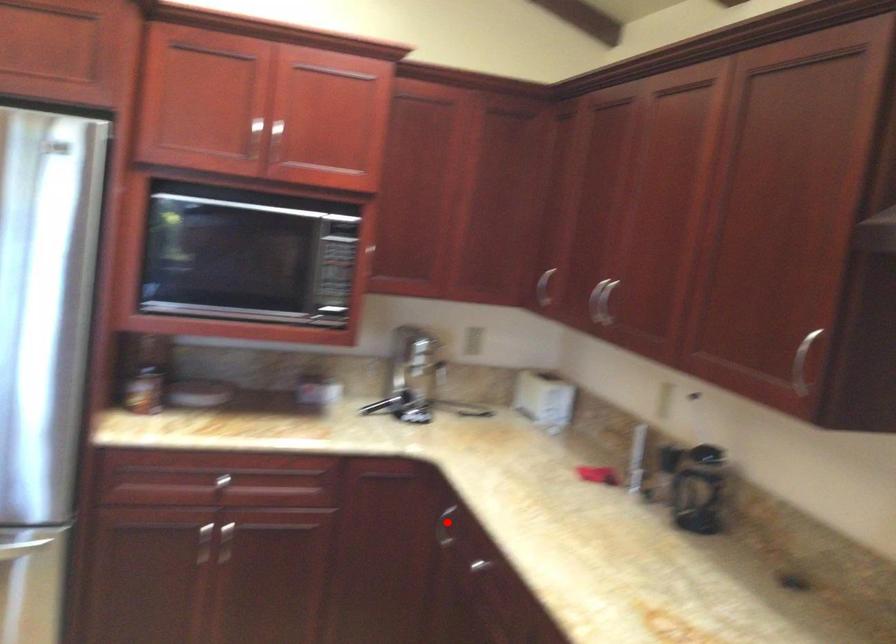
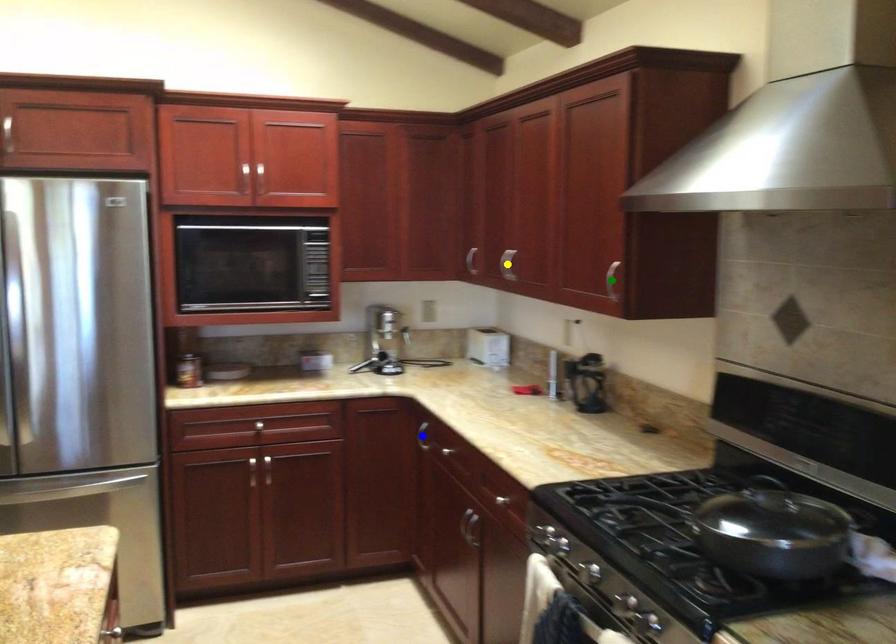
Question: I am providing you with two images of the same scene from different viewpoints. A red point is marked on the first image. You are given multiple points on the second image. Which spot in image 2 lines up with the point in image 1?

Choices:
 (A) green point
 (B) yellow point
 (C) blue point

Answer: (C)